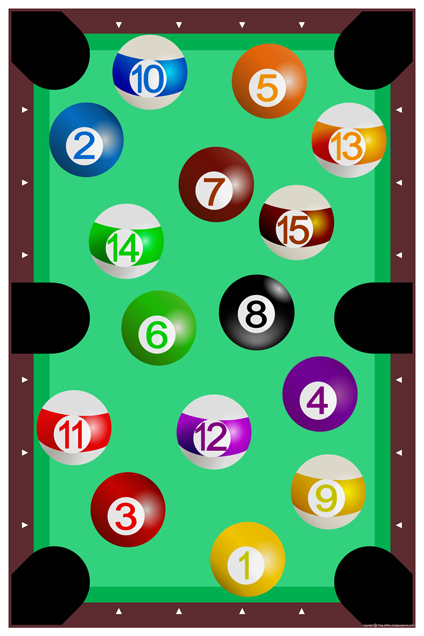
Find the location of a particular element. The image size is (424, 636). pool table is located at coordinates tap(144, 179).